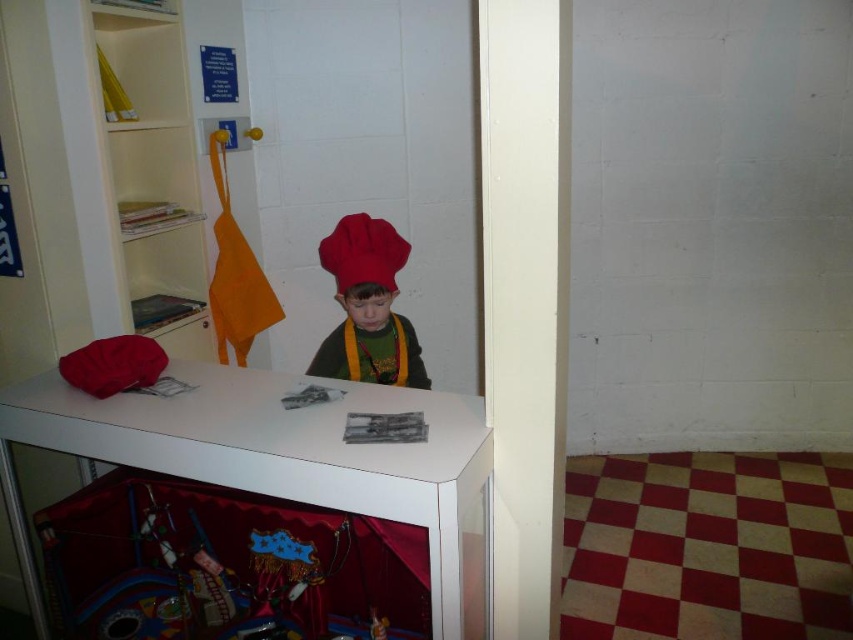
Locate an element on the screen. white glossy bookshelf at upper left is located at coordinates (132, 166).

Which of these two, white glossy bookshelf at upper left or matte red chef hat at center, stands taller?

white glossy bookshelf at upper left

The height and width of the screenshot is (640, 853). Identify the location of white glossy bookshelf at upper left. (132, 166).